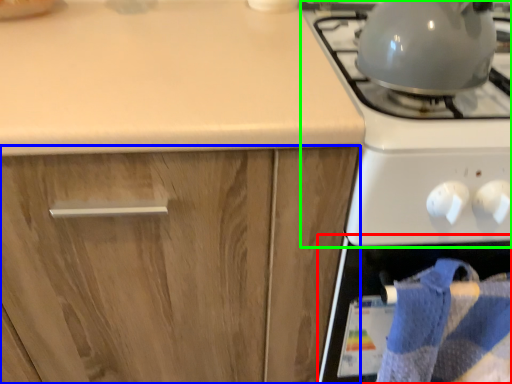
Question: Considering the real-world distances, which object is farthest from oven (highlighted by a red box)? cabinetry (highlighted by a blue box) or gas stove (highlighted by a green box)?

Choices:
 (A) cabinetry
 (B) gas stove

Answer: (A)